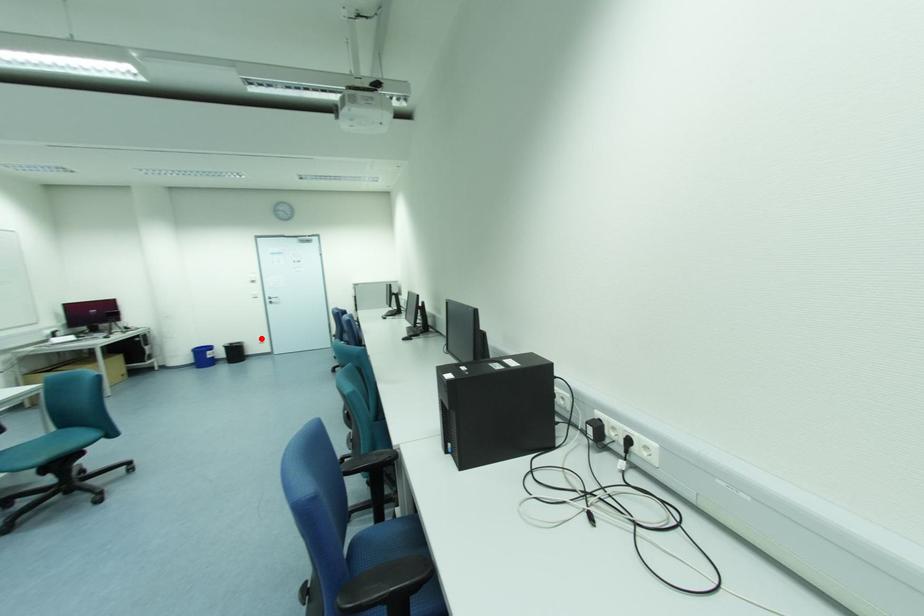
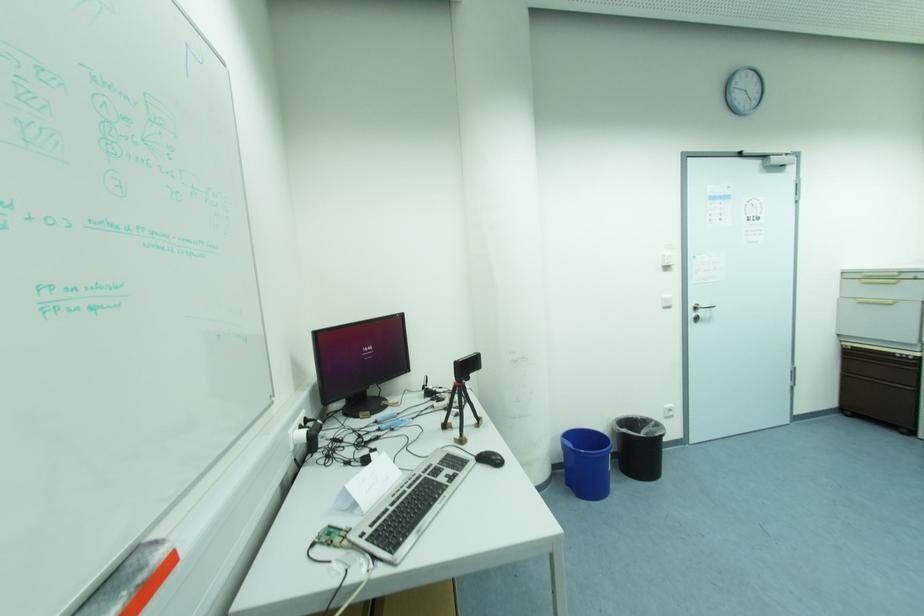
The point at the highlighted location is marked in the first image. Where is the corresponding point in the second image?

(667, 406)